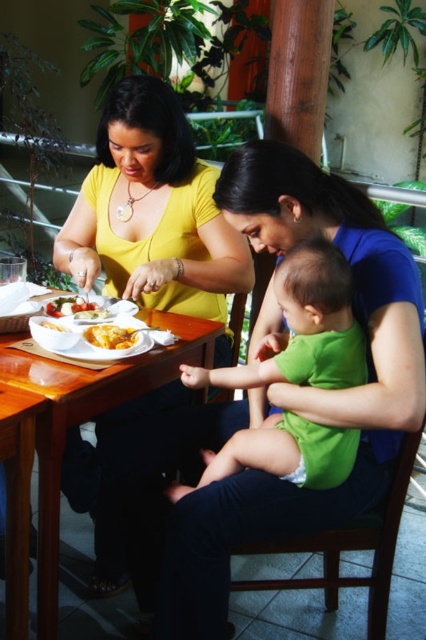
Question: Which point is farther to the camera?

Choices:
 (A) (94, 349)
 (B) (313, 333)
 (C) (85, 339)

Answer: (C)

Question: Which point is farther to the camera?

Choices:
 (A) yellow matte shirt at upper left
 (B) yellow cheesy pasta at table center

Answer: (A)

Question: Where is wooden table at center located in relation to yellow cheesy pasta at table center in the image?

Choices:
 (A) left
 (B) right

Answer: (A)

Question: Does green fabric baby at center appear under white matte bowl at table center?

Choices:
 (A) no
 (B) yes

Answer: (B)

Question: Which is farther from the yellow matte shirt at upper left?

Choices:
 (A) yellow cheesy pasta at table center
 (B) green fabric baby at center
 (C) matte yellow plate at center

Answer: (B)

Question: Can you confirm if yellow matte shirt at upper left is thinner than green fabric baby at center?

Choices:
 (A) yes
 (B) no

Answer: (B)